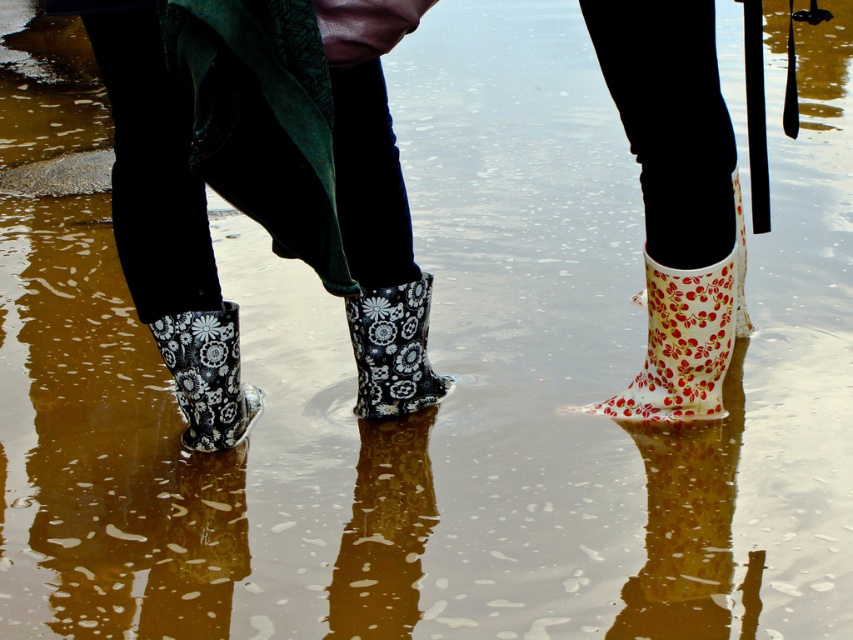
Question: From the image, what is the correct spatial relationship of floral-patterned rubber boot at right in relation to floral rubber boot at center?

Choices:
 (A) right
 (B) left

Answer: (A)

Question: Which object is farther from the camera taking this photo?

Choices:
 (A) floral matte rubber boot at lower left
 (B) floral-patterned rubber boot at right
 (C) floral-patterned rubber boots at left
 (D) floral rubber boot at center

Answer: (D)

Question: Considering the real-world distances, which object is closest to the floral matte rubber boot at lower left?

Choices:
 (A) floral rubber boot at center
 (B) floral-patterned rubber boot at right

Answer: (A)

Question: Which point is closer to the camera?

Choices:
 (A) (194, 348)
 (B) (419, 339)
 (C) (410, 316)
 (D) (711, 336)

Answer: (A)

Question: From the image, what is the correct spatial relationship of floral-patterned rubber boots at left in relation to floral-patterned rubber boot at right?

Choices:
 (A) below
 (B) above

Answer: (B)

Question: Can you confirm if floral-patterned rubber boots at left is bigger than floral-patterned rubber boot at right?

Choices:
 (A) no
 (B) yes

Answer: (B)